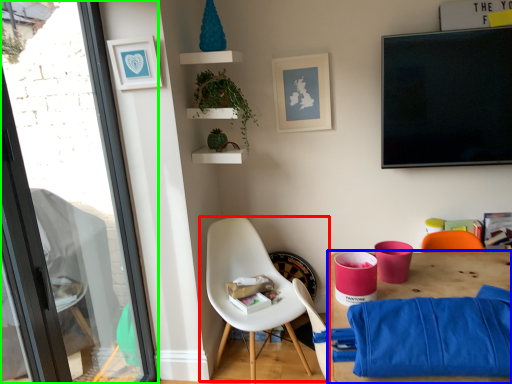
Question: Considering the real-world distances, which object is farthest from chair (highlighted by a red box)? desk (highlighted by a blue box) or window (highlighted by a green box)?

Choices:
 (A) desk
 (B) window

Answer: (B)